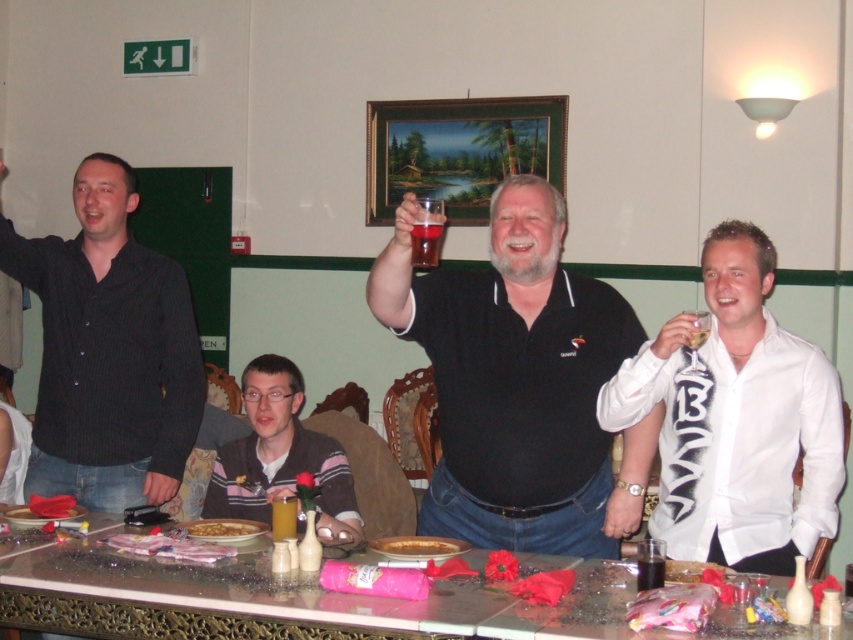
Is the position of black pinstripe shirt at left more distant than that of translucent plastic cup at center?

Yes, black pinstripe shirt at left is further from the viewer.

This screenshot has height=640, width=853. Describe the element at coordinates (108, 352) in the screenshot. I see `black pinstripe shirt at left` at that location.

At what (x,y) coordinates should I click in order to perform the action: click on black pinstripe shirt at left. Please return your answer as a coordinate pair (x, y). The height and width of the screenshot is (640, 853). Looking at the image, I should click on (108, 352).

Based on the photo, between striped sweater at lower center and brown matte nuts at center, which one appears on the right side from the viewer's perspective?

striped sweater at lower center is more to the right.

Describe the element at coordinates (280, 456) in the screenshot. I see `striped sweater at lower center` at that location.

Between point (347, 532) and point (206, 524), which one is positioned behind?

The point (347, 532) is more distant.

Find the location of a particular element. The width and height of the screenshot is (853, 640). striped sweater at lower center is located at coordinates (280, 456).

Who is positioned more to the left, black matte shirt at center or translucent plastic cup at center?

translucent plastic cup at center is more to the left.

In the scene shown: Is black matte shirt at center bigger than translucent plastic cup at center?

Yes, black matte shirt at center is bigger than translucent plastic cup at center.

This screenshot has height=640, width=853. I want to click on black matte shirt at center, so click(520, 385).

You are a GUI agent. You are given a task and a screenshot of the screen. Output one action in this format:
    pyautogui.click(x=<x>, y=<y>)
    Task: Click on the black matte shirt at center
    This screenshot has height=640, width=853.
    Given the screenshot: What is the action you would take?
    pyautogui.click(x=520, y=385)